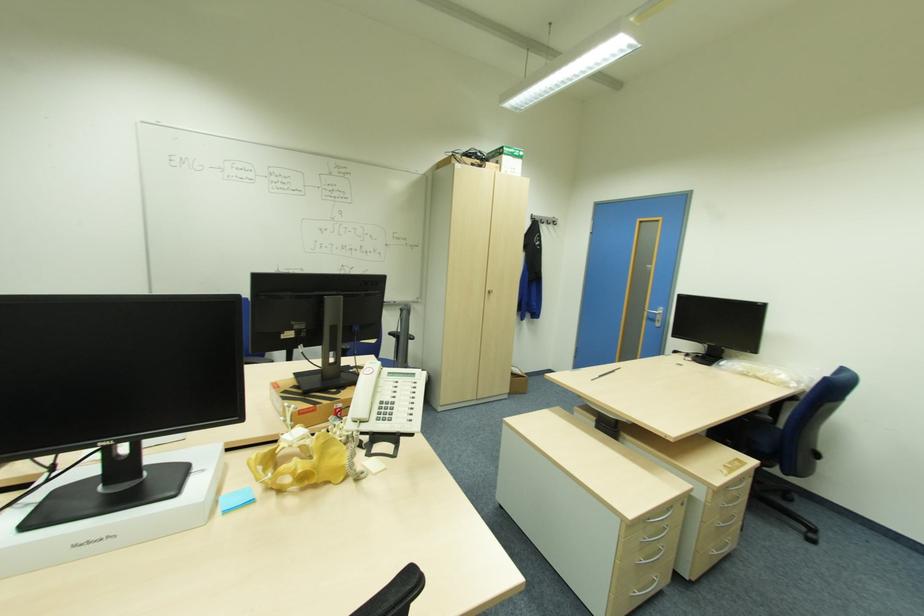
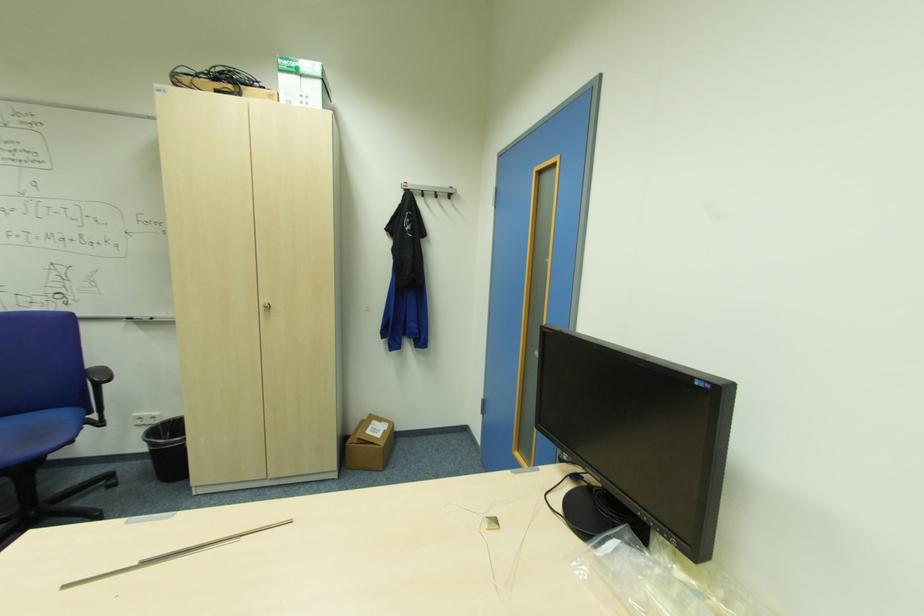
Locate, in the second image, the point that corresponds to point (550, 220) in the first image.

(439, 192)